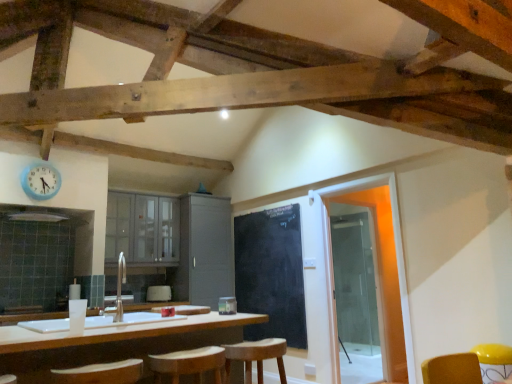
Image resolution: width=512 pixels, height=384 pixels. I want to click on vacant area on top of wooden bar stool at center (from a real-world perspective), so click(254, 342).